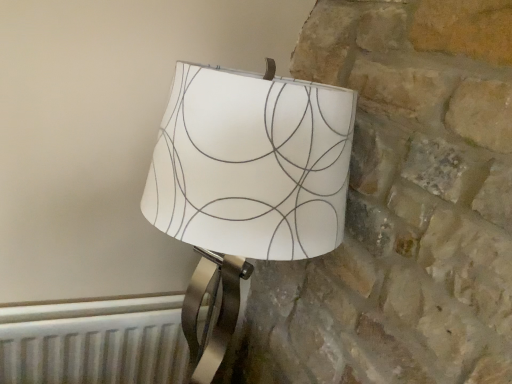
Question: Is white paper lampshade at center in front of or behind white metallic radiator at lower left in the image?

Choices:
 (A) behind
 (B) front

Answer: (B)

Question: From a real-world perspective, is white paper lampshade at center physically located above or below white metallic radiator at lower left?

Choices:
 (A) above
 (B) below

Answer: (A)

Question: Visually, is white paper lampshade at center positioned to the left or to the right of white metallic radiator at lower left?

Choices:
 (A) right
 (B) left

Answer: (A)

Question: Considering their positions, is white metallic radiator at lower left located in front of or behind white paper lampshade at center?

Choices:
 (A) front
 (B) behind

Answer: (B)

Question: Considering the positions of white metallic radiator at lower left and white paper lampshade at center in the image, is white metallic radiator at lower left taller or shorter than white paper lampshade at center?

Choices:
 (A) tall
 (B) short

Answer: (B)

Question: Looking at the image, does white metallic radiator at lower left seem bigger or smaller compared to white paper lampshade at center?

Choices:
 (A) big
 (B) small

Answer: (B)

Question: Is white metallic radiator at lower left to the left or to the right of white paper lampshade at center in the image?

Choices:
 (A) left
 (B) right

Answer: (A)